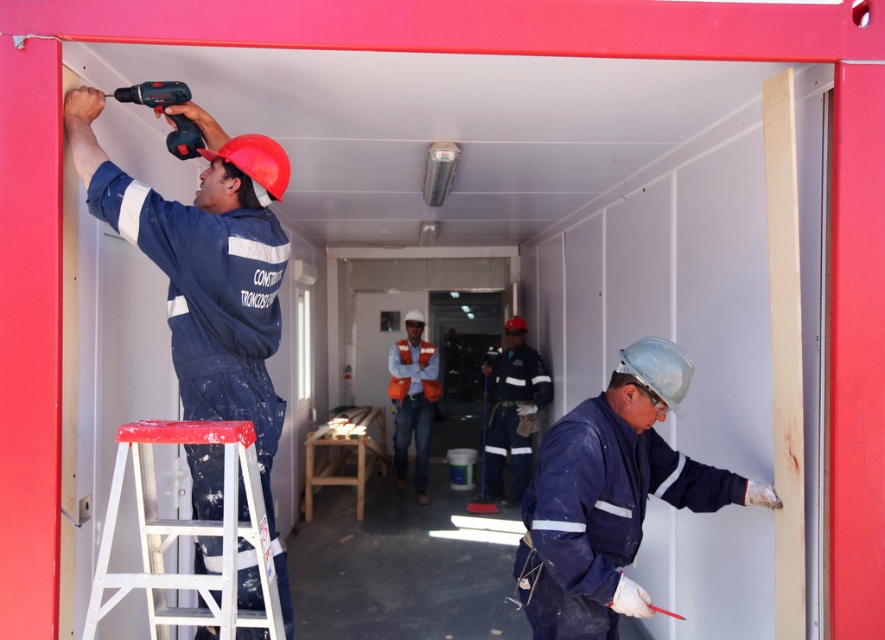
Between blue fabric uniform at center and orange reflective vest at center, which one has more height?

With more height is orange reflective vest at center.

I want to click on blue fabric uniform at center, so click(x=513, y=412).

Who is positioned more to the left, blue matte workwear at center or orange reflective vest at center?

orange reflective vest at center

Does blue matte workwear at center have a lesser height compared to orange reflective vest at center?

Yes, blue matte workwear at center is shorter than orange reflective vest at center.

Identify the location of blue matte workwear at center. coord(612,496).

Measure the distance between point [586,401] and camera.

The distance of point [586,401] from camera is 7.91 feet.

Does blue matte workwear at center have a greater height compared to blue fabric uniform at center?

No, blue matte workwear at center is not taller than blue fabric uniform at center.

At what (x,y) coordinates should I click in order to perform the action: click on blue matte workwear at center. Please return your answer as a coordinate pair (x, y). Looking at the image, I should click on (612, 496).

The image size is (885, 640). I want to click on blue matte workwear at center, so (612, 496).